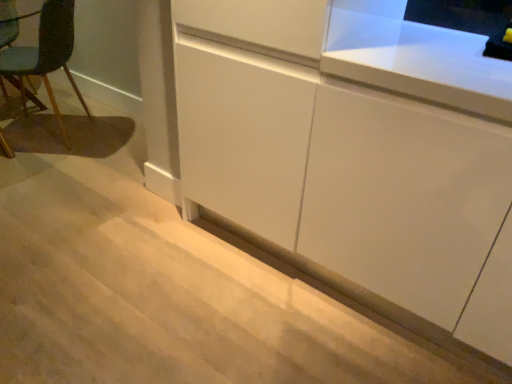
Question: Is white matte cabinet at lower center, the second cabinetry from the right, taller than teal fabric chair at left?

Choices:
 (A) yes
 (B) no

Answer: (B)

Question: Is white matte cabinet at lower center, which is counted as the first cabinetry, starting from the left, bigger than teal fabric chair at left?

Choices:
 (A) yes
 (B) no

Answer: (A)

Question: Considering the relative sizes of white matte cabinet at lower center, the second cabinetry from the right, and teal fabric chair at left in the image provided, is white matte cabinet at lower center, the second cabinetry from the right, smaller than teal fabric chair at left?

Choices:
 (A) no
 (B) yes

Answer: (A)

Question: From the image's perspective, is white matte cabinet at lower center, the second cabinetry from the right, under teal fabric chair at left?

Choices:
 (A) no
 (B) yes

Answer: (B)

Question: Does white matte cabinet at lower center, which is counted as the first cabinetry, starting from the left, turn towards teal fabric chair at left?

Choices:
 (A) no
 (B) yes

Answer: (A)

Question: From a real-world perspective, is teal fabric chair at left physically located above or below white matte cabinet at center, which is counted as the 2th cabinetry, starting from the left?

Choices:
 (A) above
 (B) below

Answer: (B)

Question: From the image's perspective, relative to white matte cabinet at center, which is counted as the 2th cabinetry, starting from the left, is teal fabric chair at left above or below?

Choices:
 (A) above
 (B) below

Answer: (A)

Question: Relative to white matte cabinet at center, which is counted as the 2th cabinetry, starting from the left, is teal fabric chair at left in front or behind?

Choices:
 (A) front
 (B) behind

Answer: (B)

Question: Considering the positions of teal fabric chair at left and white matte cabinet at center, which is counted as the 2th cabinetry, starting from the left, in the image, is teal fabric chair at left taller or shorter than white matte cabinet at center, which is counted as the 2th cabinetry, starting from the left,?

Choices:
 (A) tall
 (B) short

Answer: (B)

Question: Considering their positions, is white matte cabinet at lower center, the second cabinetry from the right, located in front of or behind teal fabric chair at left?

Choices:
 (A) behind
 (B) front

Answer: (B)

Question: In terms of width, does white matte cabinet at lower center, the second cabinetry from the right, look wider or thinner when compared to teal fabric chair at left?

Choices:
 (A) thin
 (B) wide

Answer: (B)

Question: Considering the relative positions of white matte cabinet at lower center, the second cabinetry from the right, and teal fabric chair at left in the image provided, is white matte cabinet at lower center, the second cabinetry from the right, to the left or to the right of teal fabric chair at left?

Choices:
 (A) right
 (B) left

Answer: (A)

Question: In terms of height, does white matte cabinet at lower center, which is counted as the first cabinetry, starting from the left, look taller or shorter compared to teal fabric chair at left?

Choices:
 (A) tall
 (B) short

Answer: (B)

Question: Is white matte cabinet at center, positioned as the 1th cabinetry in right-to-left order, in front of or behind teal fabric chair at left in the image?

Choices:
 (A) behind
 (B) front

Answer: (B)

Question: Considering the relative positions of white matte cabinet at center, positioned as the 1th cabinetry in right-to-left order, and teal fabric chair at left in the image provided, is white matte cabinet at center, positioned as the 1th cabinetry in right-to-left order, to the left or to the right of teal fabric chair at left?

Choices:
 (A) left
 (B) right

Answer: (B)